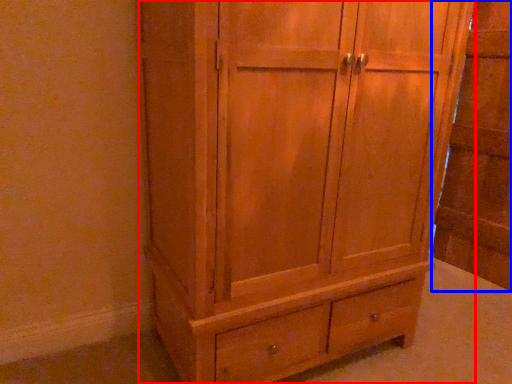
Question: Which object appears farthest to the camera in this image, cupboard (highlighted by a red box) or side cabinet (highlighted by a blue box)?

Choices:
 (A) cupboard
 (B) side cabinet

Answer: (B)